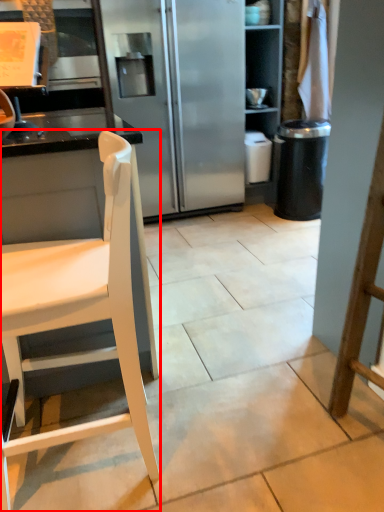
Question: From the image's perspective, what is the correct spatial positioning of chair (annotated by the red box) in reference to trash bin/can?

Choices:
 (A) above
 (B) below

Answer: (B)